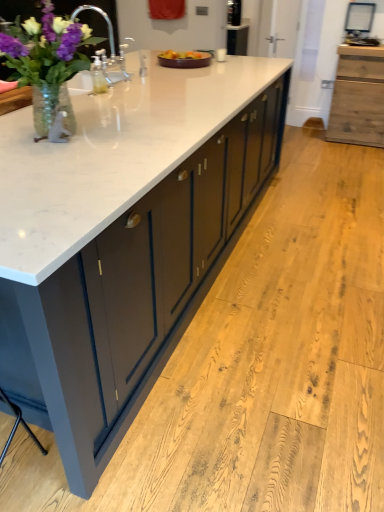
Find the location of a particular element. Image resolution: width=384 pixels, height=512 pixels. free space to the right of white glossy sink at upper left is located at coordinates (145, 81).